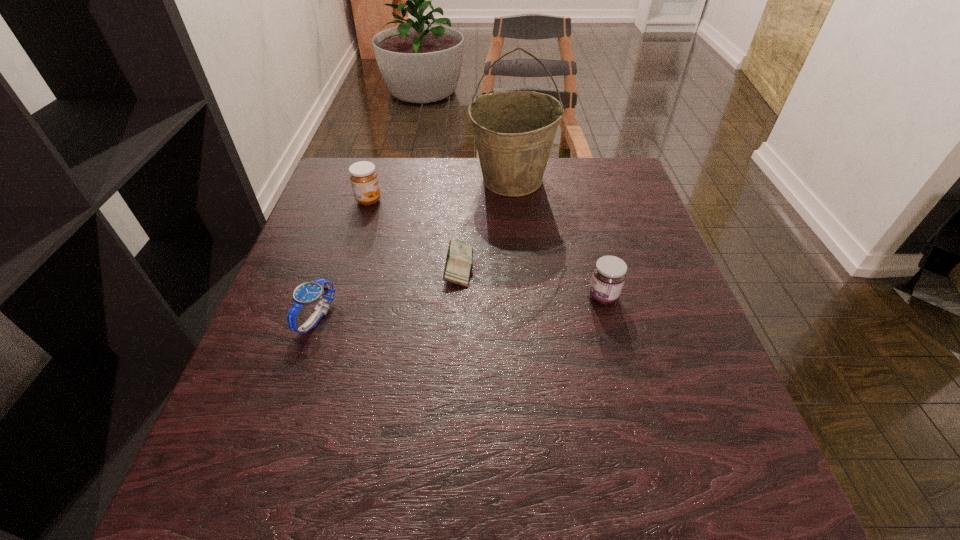
Image resolution: width=960 pixels, height=540 pixels. I want to click on vacant space located on the front label of the rightmost object, so click(505, 297).

Image resolution: width=960 pixels, height=540 pixels. I want to click on vacant space located on the right of the watch, so click(x=403, y=318).

The height and width of the screenshot is (540, 960). Find the location of `vacant position located 0.130m on the back of the diary`. vacant position located 0.130m on the back of the diary is located at coordinates (461, 213).

At what (x,y) coordinates should I click in order to perform the action: click on wine bucket that is at the far edge. Please return your answer as a coordinate pair (x, y). This screenshot has height=540, width=960. Looking at the image, I should click on (514, 132).

Identify the location of jam that is positioned at the far edge. The width and height of the screenshot is (960, 540). (364, 178).

Locate an element on the screen. jam situated at the left edge is located at coordinates (364, 178).

Find the location of a particular element. This screenshot has height=540, width=960. watch situated at the left edge is located at coordinates (308, 293).

Where is `object at the right edge`? This screenshot has height=540, width=960. object at the right edge is located at coordinates (609, 274).

The height and width of the screenshot is (540, 960). I want to click on object present at the far left corner, so click(364, 178).

In order to click on vacant space at the far edge of the desktop in this screenshot , I will do `click(459, 200)`.